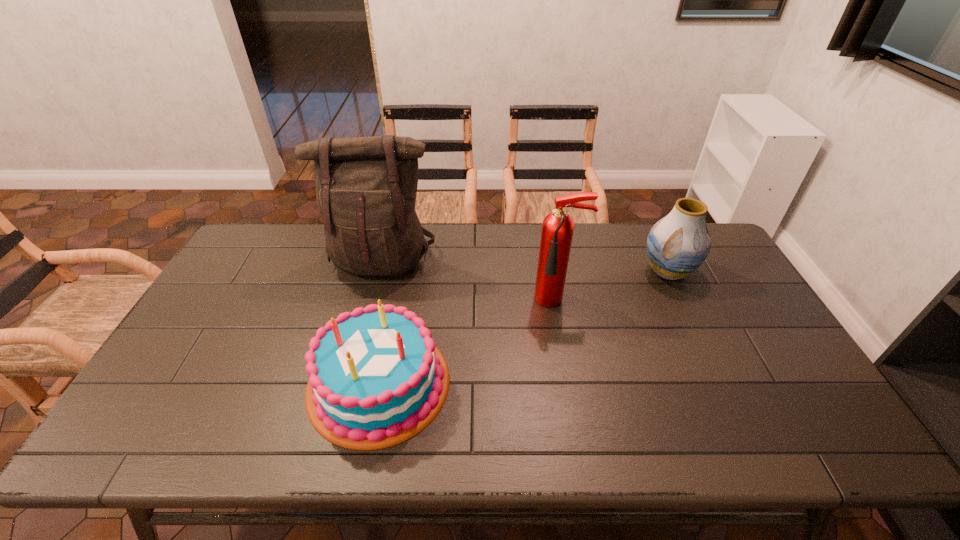
Find the location of `backpack`. backpack is located at coordinates (366, 187).

Identify the location of the second object from right to left. (557, 231).

This screenshot has width=960, height=540. Find the location of `the third shortest object`. the third shortest object is located at coordinates (557, 231).

Image resolution: width=960 pixels, height=540 pixels. I want to click on vase, so click(678, 244).

The height and width of the screenshot is (540, 960). Find the location of `the nearest object`. the nearest object is located at coordinates (374, 378).

Where is `free point located 0.160m on the open flap of the backpack`? This screenshot has height=540, width=960. free point located 0.160m on the open flap of the backpack is located at coordinates (365, 325).

In order to click on vacant space situated at the nozzle of the third shortest object in this screenshot , I will do `click(570, 373)`.

You are a GUI agent. You are given a task and a screenshot of the screen. Output one action in this format:
    pyautogui.click(x=<x>, y=<y>)
    Task: Click on the blank area located 0.100m on the right of the rightmost object
    The height and width of the screenshot is (540, 960).
    Given the screenshot: What is the action you would take?
    pyautogui.click(x=727, y=272)

Identify the location of free space located 0.050m on the back of the nearest object. This screenshot has height=540, width=960. (393, 316).

At what (x,y) coordinates should I click in order to perform the action: click on backpack present at the far edge. Please return your answer as a coordinate pair (x, y). The width and height of the screenshot is (960, 540). Looking at the image, I should click on tap(366, 187).